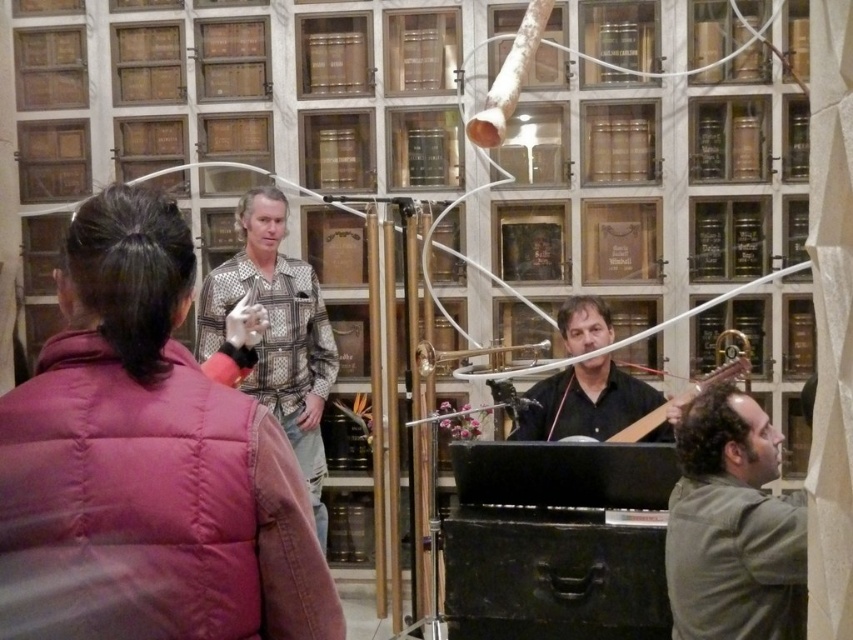
Question: Which of the following is the closest to the observer?

Choices:
 (A) black matte guitar at center
 (B) puffy pink vest at center
 (C) patterned shirt at center

Answer: (B)

Question: Estimate the real-world distances between objects in this image. Which object is farther from the green matte shirt at lower right?

Choices:
 (A) puffy pink vest at center
 (B) patterned shirt at center
 (C) black matte guitar at center

Answer: (B)

Question: Considering the relative positions of puffy pink vest at center and black matte guitar at center in the image provided, where is puffy pink vest at center located with respect to black matte guitar at center?

Choices:
 (A) left
 (B) right

Answer: (A)

Question: Considering the real-world distances, which object is farthest from the puffy pink vest at center?

Choices:
 (A) black matte guitar at center
 (B) patterned shirt at center
 (C) green matte shirt at lower right

Answer: (B)

Question: Is puffy pink vest at center to the right of green matte shirt at lower right from the viewer's perspective?

Choices:
 (A) yes
 (B) no

Answer: (B)

Question: Is green matte shirt at lower right further to camera compared to patterned shirt at center?

Choices:
 (A) no
 (B) yes

Answer: (A)